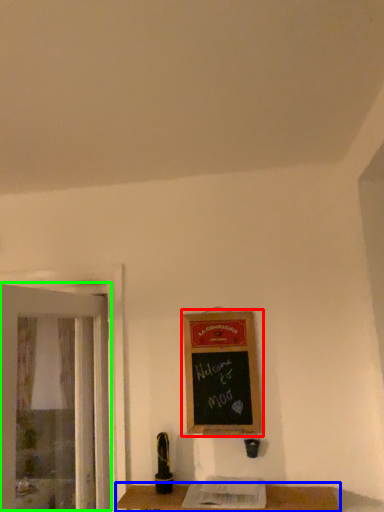
Question: Estimate the real-world distances between objects in this image. Which object is closer to bulletin board (highlighted by a red box), table (highlighted by a blue box) or screen door (highlighted by a green box)?

Choices:
 (A) table
 (B) screen door

Answer: (A)